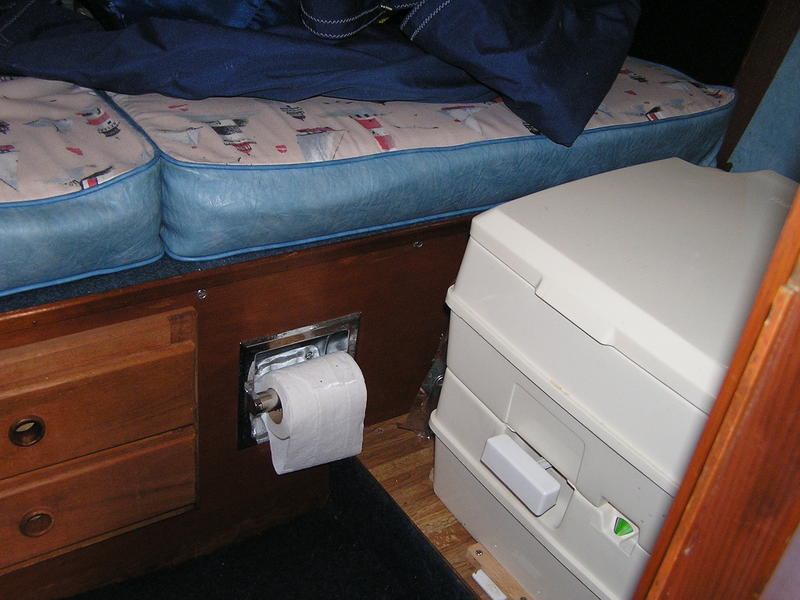
Locate an element on the screen. The image size is (800, 600). toilet paper is located at coordinates (314, 411).